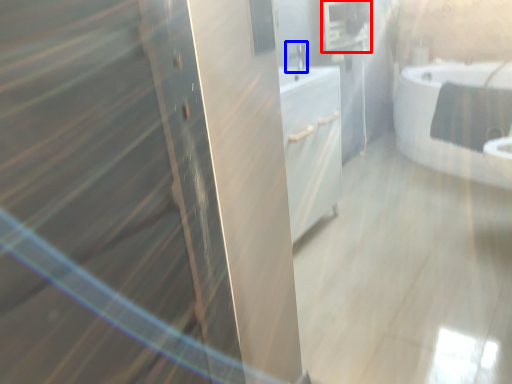
Question: Which of the following is the farthest to the observer, medicine cabinet (highlighted by a red box) or faucet (highlighted by a blue box)?

Choices:
 (A) medicine cabinet
 (B) faucet

Answer: (A)